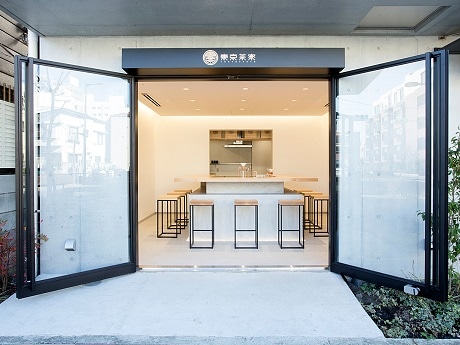
You are a GUI agent. You are given a task and a screenshot of the screen. Output one action in this format:
    pyautogui.click(x=<x>, y=<y>)
    Task: Click on the door
    The width and height of the screenshot is (460, 345).
    Given the screenshot: What is the action you would take?
    pyautogui.click(x=77, y=151), pyautogui.click(x=396, y=193)